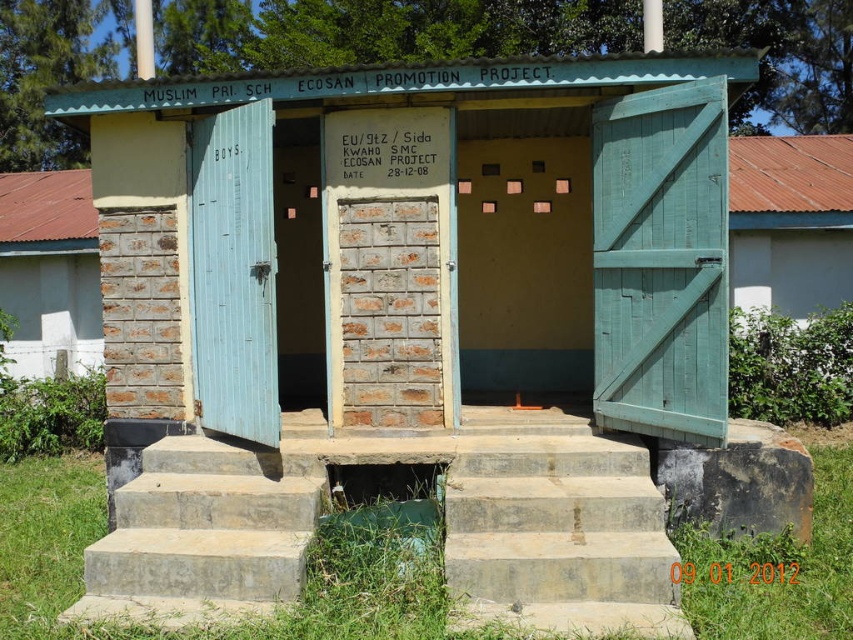
You are a maintenance worker inspecting the restroom facility. You notice two areas that need attention. One is the white smooth wall at upper right and the other is the green grass at lower right. Based on their sizes, which area would require more materials for repairs?

The white smooth wall at upper right is larger in size than the green grass at lower right, so it would require more materials for repairs.